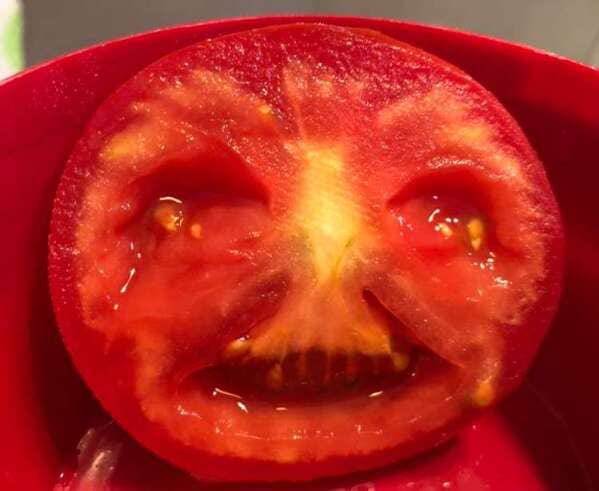
Where is `red bowl`? Image resolution: width=599 pixels, height=491 pixels. red bowl is located at coordinates (77, 66).